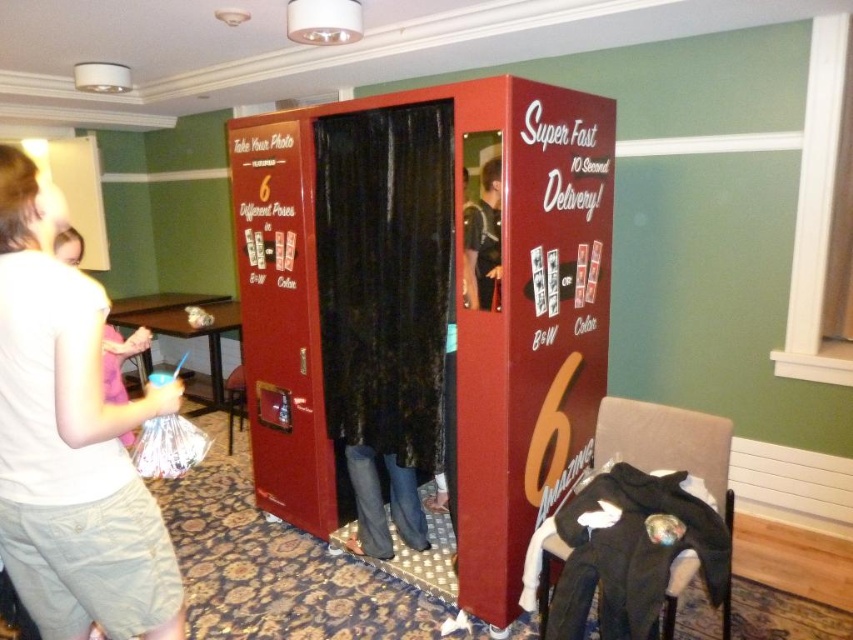
Question: Which of the following is the closest to the observer?

Choices:
 (A) (44, 259)
 (B) (485, 252)

Answer: (A)

Question: Which point is closer to the camera?

Choices:
 (A) (401, 264)
 (B) (469, 240)

Answer: (B)

Question: Does white cotton shirt at left have a greater width compared to dark blue shirt at center?

Choices:
 (A) yes
 (B) no

Answer: (A)

Question: Estimate the real-world distances between objects in this image. Which object is farther from the metallic red photo booth at center?

Choices:
 (A) white cotton shirt at left
 (B) dark blue shirt at center

Answer: (A)

Question: Observing the image, what is the correct spatial positioning of metallic red photo booth at center in reference to dark blue shirt at center?

Choices:
 (A) below
 (B) above

Answer: (A)

Question: Where is metallic red photo booth at center located in relation to dark blue shirt at center in the image?

Choices:
 (A) right
 (B) left

Answer: (B)